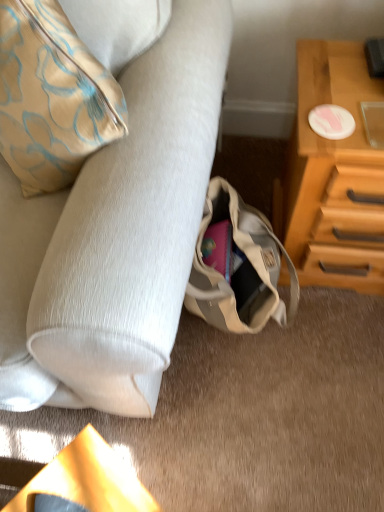
Question: From the image's perspective, is wooden chest of drawers at right beneath beige canvas bag at lower center?

Choices:
 (A) no
 (B) yes

Answer: (A)

Question: From the image's perspective, does wooden chest of drawers at right appear higher than beige canvas bag at lower center?

Choices:
 (A) no
 (B) yes

Answer: (B)

Question: From a real-world perspective, is wooden chest of drawers at right beneath beige canvas bag at lower center?

Choices:
 (A) yes
 (B) no

Answer: (B)

Question: Can you confirm if wooden chest of drawers at right is positioned to the right of beige canvas bag at lower center?

Choices:
 (A) no
 (B) yes

Answer: (B)

Question: Does wooden chest of drawers at right have a larger size compared to beige canvas bag at lower center?

Choices:
 (A) yes
 (B) no

Answer: (A)

Question: Is wooden chest of drawers at right shorter than beige canvas bag at lower center?

Choices:
 (A) no
 (B) yes

Answer: (A)

Question: From the image's perspective, does beige canvas bag at lower center appear higher than wooden chest of drawers at right?

Choices:
 (A) yes
 (B) no

Answer: (B)

Question: Considering the relative sizes of beige canvas bag at lower center and wooden chest of drawers at right in the image provided, is beige canvas bag at lower center smaller than wooden chest of drawers at right?

Choices:
 (A) no
 (B) yes

Answer: (B)

Question: Is beige canvas bag at lower center aimed at wooden chest of drawers at right?

Choices:
 (A) yes
 (B) no

Answer: (B)

Question: Does beige canvas bag at lower center come behind wooden chest of drawers at right?

Choices:
 (A) no
 (B) yes

Answer: (B)

Question: Is beige canvas bag at lower center at the left side of wooden chest of drawers at right?

Choices:
 (A) no
 (B) yes

Answer: (B)

Question: Can wooden chest of drawers at right be found inside beige canvas bag at lower center?

Choices:
 (A) no
 (B) yes

Answer: (A)

Question: Is the surface of beige canvas bag at lower center in direct contact with suede-like beige couch at lower left?

Choices:
 (A) no
 (B) yes

Answer: (A)